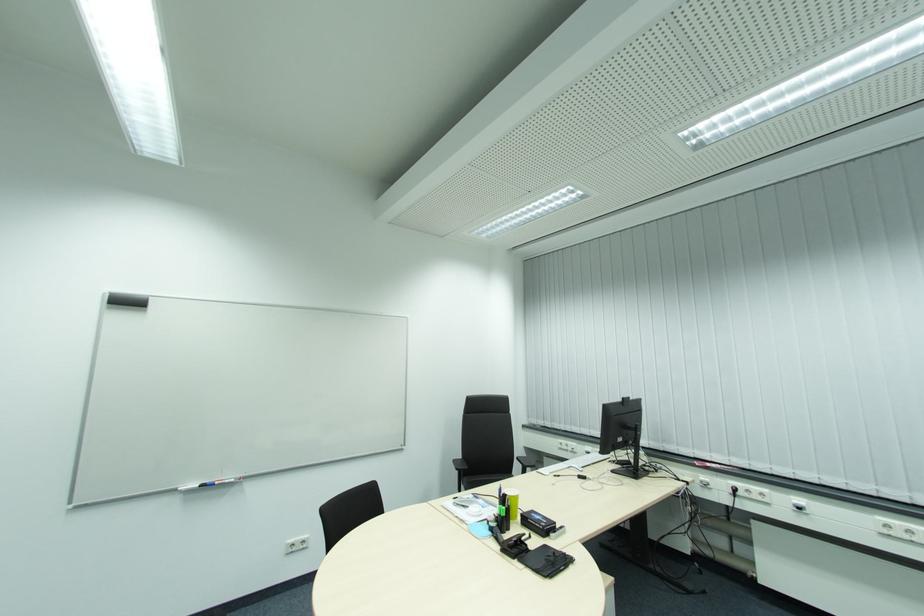
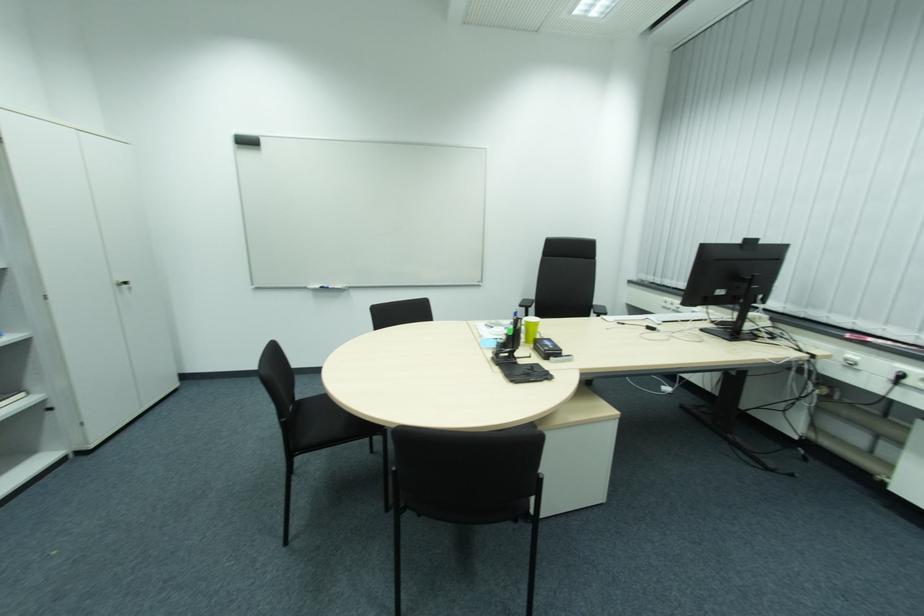
In the second image, find the point that corresponds to [546,528] in the first image.

(550, 351)